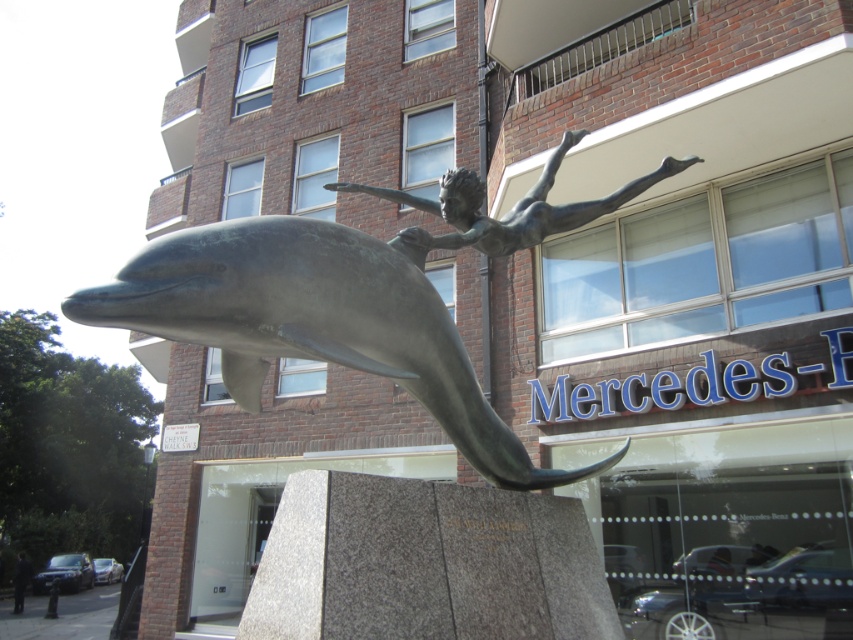
Question: Is bronze dolphin at center thinner than bronze statue at upper center?

Choices:
 (A) no
 (B) yes

Answer: (A)

Question: Is bronze dolphin at center closer to camera compared to bronze statue at upper center?

Choices:
 (A) no
 (B) yes

Answer: (B)

Question: Which point is farther to the camera?

Choices:
 (A) (378, 339)
 (B) (614, 198)

Answer: (B)

Question: Is bronze dolphin at center wider than bronze statue at upper center?

Choices:
 (A) no
 (B) yes

Answer: (B)